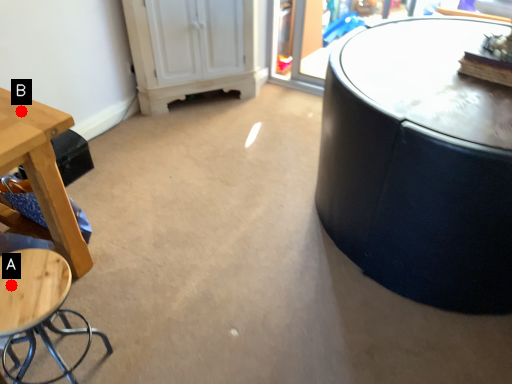
Question: Two points are circled on the image, labeled by A and B beside each circle. Which of the following is the closest to the observer?

Choices:
 (A) A is closer
 (B) B is closer

Answer: (A)